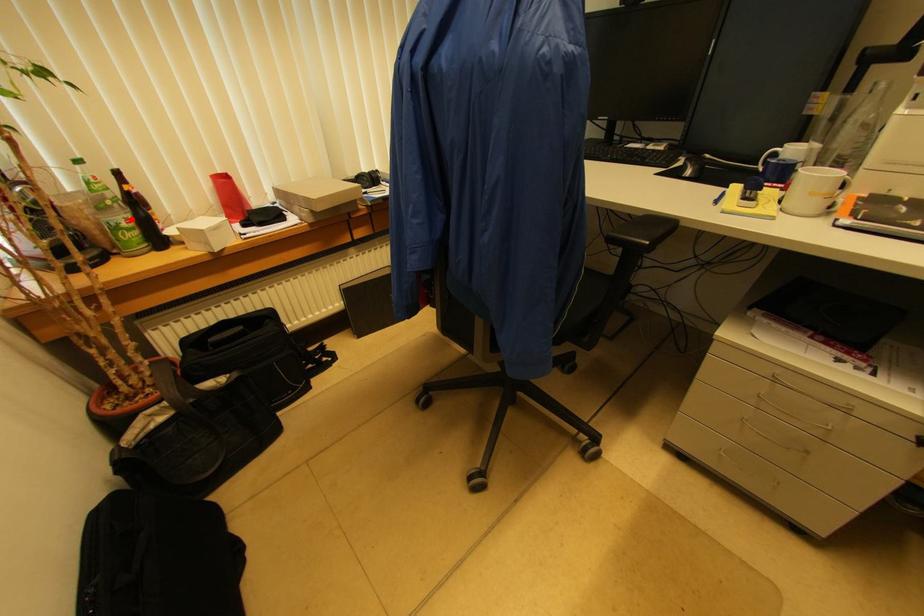
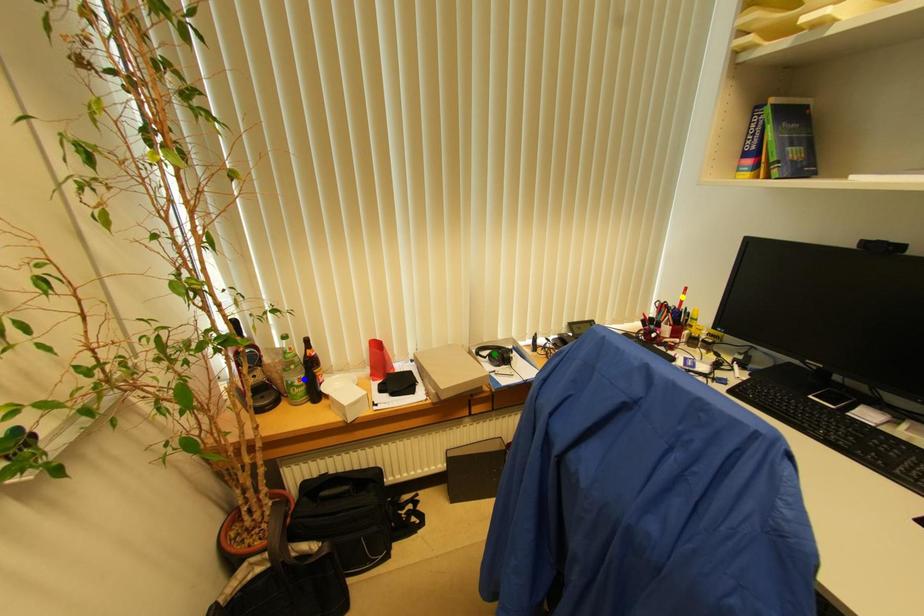
Question: I am providing you with two images of the same scene from different viewpoints. A red point is marked on the first image. You are given multiple points on the second image. Which point in image 2 is actually the same real-world point as the red point in image 1?

Choices:
 (A) yellow point
 (B) blue point
 (C) green point

Answer: (B)